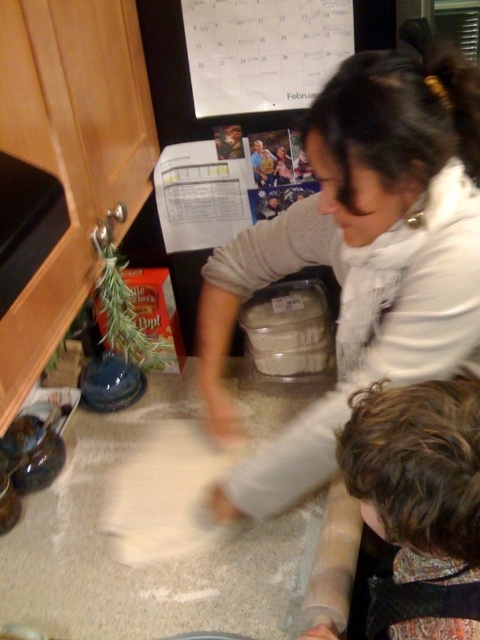
Question: Among these objects, which one is nearest to the camera?

Choices:
 (A) white paper calendar at upper center
 (B) white textured sweater at upper center
 (C) curly brown hair at lower right
 (D) clear plastic container at center

Answer: (C)

Question: In this image, where is curly brown hair at lower right located relative to clear plastic container at center?

Choices:
 (A) left
 (B) right

Answer: (B)

Question: Does white textured sweater at upper center appear under curly brown hair at lower right?

Choices:
 (A) no
 (B) yes

Answer: (A)

Question: Which point is farther from the camera taking this photo?

Choices:
 (A) (204, 113)
 (B) (365, 301)
 (C) (301, 316)

Answer: (C)

Question: In this image, where is curly brown hair at lower right located relative to white paper calendar at upper center?

Choices:
 (A) below
 (B) above

Answer: (A)

Question: Based on their relative distances, which object is nearer to the curly brown hair at lower right?

Choices:
 (A) white textured sweater at upper center
 (B) clear plastic container at center
 (C) white paper calendar at upper center

Answer: (A)